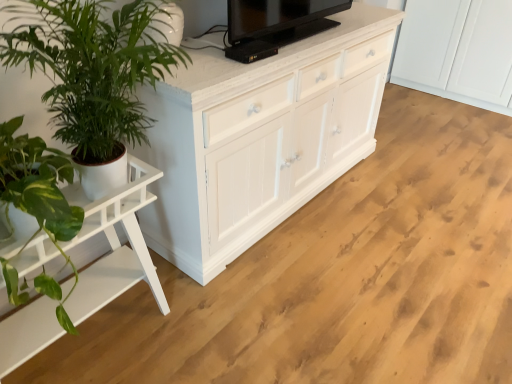
Locate an element on the screen. free space to the right of white wood table at left is located at coordinates (210, 329).